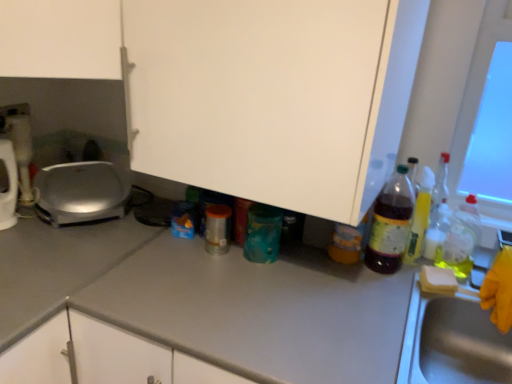
Question: Can you confirm if metallic stainless steel sink at right is taller than metallic silver toaster at left, marked as the 2th appliance in a right-to-left arrangement?

Choices:
 (A) no
 (B) yes

Answer: (B)

Question: From a real-world perspective, is metallic stainless steel sink at right positioned over metallic silver toaster at left, the second appliance viewed from the left, based on gravity?

Choices:
 (A) yes
 (B) no

Answer: (B)

Question: Is metallic stainless steel sink at right turned away from metallic silver toaster at left, marked as the 2th appliance in a right-to-left arrangement?

Choices:
 (A) no
 (B) yes

Answer: (A)

Question: Does metallic stainless steel sink at right have a lesser width compared to metallic silver toaster at left, the second appliance viewed from the left?

Choices:
 (A) no
 (B) yes

Answer: (A)

Question: Is metallic stainless steel sink at right further to the viewer compared to metallic silver toaster at left, the second appliance viewed from the left?

Choices:
 (A) yes
 (B) no

Answer: (B)

Question: Is teal matte canister at center, positioned as the 2th bottle in left-to-right order, wider or thinner than gray matte countertop at center?

Choices:
 (A) thin
 (B) wide

Answer: (A)

Question: Which is correct: teal matte canister at center, positioned as the 2th bottle in left-to-right order, is inside gray matte countertop at center, or outside of it?

Choices:
 (A) inside
 (B) outside

Answer: (B)

Question: In the image, is teal matte canister at center, positioned as the 2th bottle in left-to-right order, on the left side or the right side of gray matte countertop at center?

Choices:
 (A) right
 (B) left

Answer: (B)

Question: Is point (279, 241) positioned closer to the camera than point (244, 279)?

Choices:
 (A) farther
 (B) closer

Answer: (A)

Question: Does point (423, 231) appear closer or farther from the camera than point (435, 238)?

Choices:
 (A) closer
 (B) farther

Answer: (B)

Question: In the image, is translucent plastic bottle at right, the 2th bottle in the right-to-left sequence, on the left side or the right side of translucent plastic bottle at right, the 5th bottle in the left-to-right sequence?

Choices:
 (A) right
 (B) left

Answer: (B)

Question: In terms of width, does translucent plastic bottle at right, the 2th bottle in the right-to-left sequence, look wider or thinner when compared to translucent plastic bottle at right, the 5th bottle in the left-to-right sequence?

Choices:
 (A) wide
 (B) thin

Answer: (B)

Question: Considering their positions, is translucent plastic bottle at right, the 2th bottle in the right-to-left sequence, located in front of or behind translucent plastic bottle at right, the 5th bottle in the left-to-right sequence?

Choices:
 (A) behind
 (B) front

Answer: (B)

Question: From a real-world perspective, is gray matte countertop at center physically located above or below gray matte countertop at center?

Choices:
 (A) below
 (B) above

Answer: (B)

Question: Is point (224, 281) closer or farther from the camera than point (78, 228)?

Choices:
 (A) farther
 (B) closer

Answer: (B)